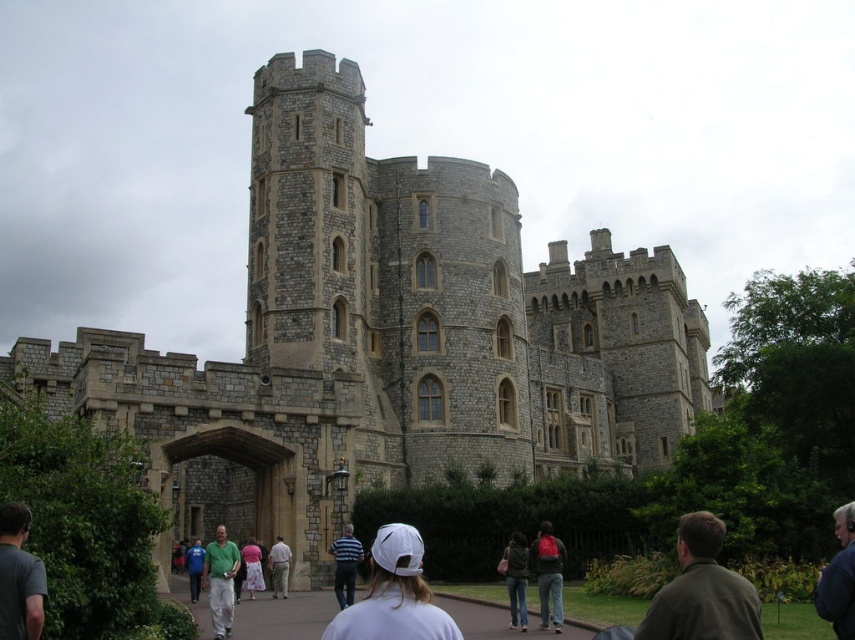
Question: Which object appears farthest from the camera in this image?

Choices:
 (A) dark blue jeans at lower right
 (B) dark brown leather jacket at lower right

Answer: (A)

Question: Estimate the real-world distances between objects in this image. Which object is closer to the dark green jacket at center?

Choices:
 (A) green matte shirt at lower center
 (B) dark brown leather jacket at lower right

Answer: (B)

Question: Does white matte baseball cap at center have a smaller size compared to gray t-shirt at lower left?

Choices:
 (A) yes
 (B) no

Answer: (B)

Question: Can you confirm if dark brown leather jacket at lower right is positioned below green fabric shirt at center?

Choices:
 (A) no
 (B) yes

Answer: (A)

Question: Does white matte baseball cap at center appear on the right side of dark blue jeans at lower right?

Choices:
 (A) yes
 (B) no

Answer: (B)

Question: Among these points, which one is nearest to the camera?

Choices:
 (A) (337, 600)
 (B) (196, 566)

Answer: (A)